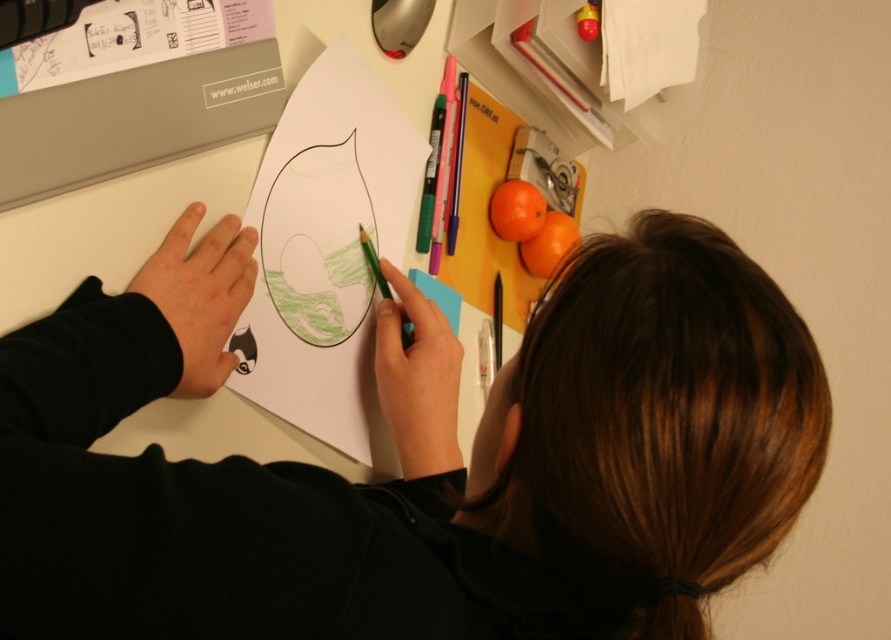
Looking at this image, you are an artist trying to organize your desk. You need to move the orange matte at upper center and orange matte at upper right. Which orange matte is covering the other one?

The orange matte at upper center is positioned over the orange matte at upper right, so it is covering the other one.

You are a delivery person who needs to place a small package between the black matte hoodie at center and the orange matte at upper right. Can you fit it there?

The distance between the black matte hoodie at center and the orange matte at upper right is 21.06 inches, so yes, the small package can be placed between them as there is enough space.

You need to place a 10 cm wide book on the desk. The black matte hoodie at center and orange matte at upper right are already there. Which object has enough space next to it to fit the book?

The black matte hoodie at center is wider than orange matte at upper right, so there is more space next to it to place the 10 cm wide book.